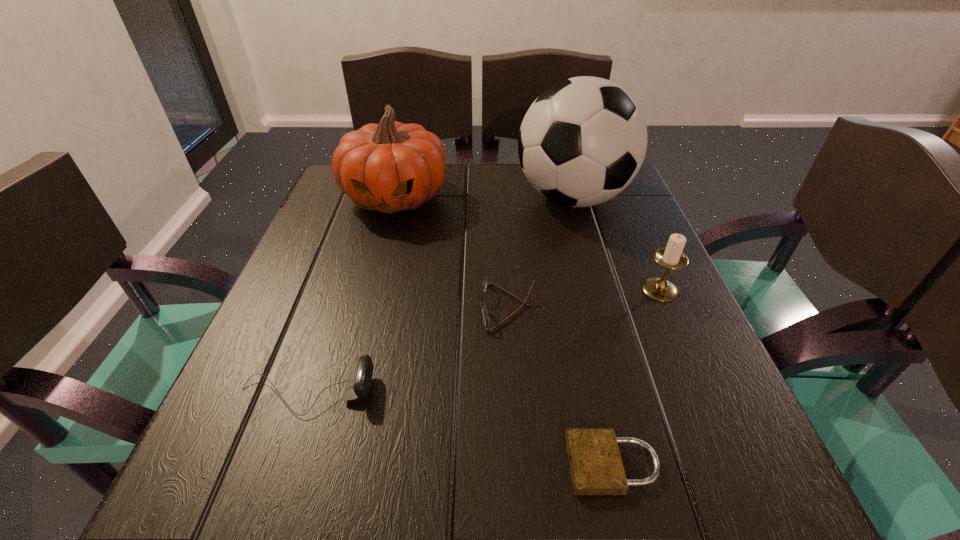
Where is `object that is at the near edge`? Image resolution: width=960 pixels, height=540 pixels. object that is at the near edge is located at coordinates (596, 467).

At what (x,y) coordinates should I click in order to perform the action: click on pumpkin that is at the left edge. Please return your answer as a coordinate pair (x, y). Looking at the image, I should click on (389, 167).

The image size is (960, 540). Find the location of `webcam located at the left edge`. webcam located at the left edge is located at coordinates (359, 380).

I want to click on soccer ball that is at the right edge, so click(583, 140).

Identify the location of candle holder present at the right edge. The height and width of the screenshot is (540, 960). (671, 257).

Locate an element on the screen. padlock located at the right edge is located at coordinates (596, 467).

At what (x,y) coordinates should I click in order to perform the action: click on object that is at the far left corner. Please return your answer as a coordinate pair (x, y). Looking at the image, I should click on (389, 167).

Locate an element on the screen. The image size is (960, 540). object present at the far right corner is located at coordinates (583, 140).

The height and width of the screenshot is (540, 960). What are the coordinates of `object that is at the near right corner` in the screenshot? It's located at (596, 467).

Image resolution: width=960 pixels, height=540 pixels. I want to click on free space at the far edge of the desktop, so click(x=508, y=211).